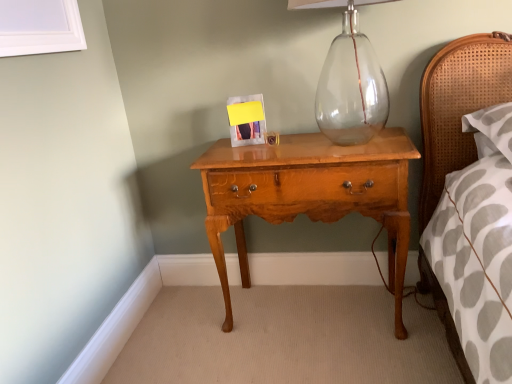
At what (x,y) coordinates should I click in order to perform the action: click on free space underneath light brown wood nightstand at center (from a real-world perspective). Please return your answer as a coordinate pair (x, y). Image resolution: width=512 pixels, height=384 pixels. Looking at the image, I should click on (312, 307).